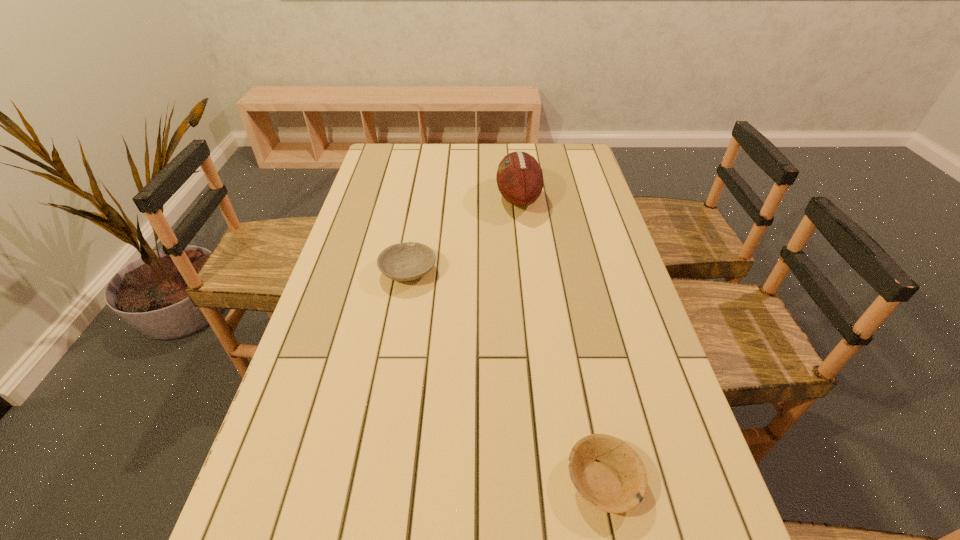
The width and height of the screenshot is (960, 540). I want to click on the tallest object, so click(x=519, y=177).

Where is `football (American)`? The image size is (960, 540). football (American) is located at coordinates (519, 177).

I want to click on the second nearest object, so click(x=407, y=261).

Where is `the farther bowl`? The height and width of the screenshot is (540, 960). the farther bowl is located at coordinates (407, 261).

Image resolution: width=960 pixels, height=540 pixels. I want to click on the nearest object, so click(608, 474).

Identify the location of the nearer bowl. (608, 474).

At what (x,y) coordinates should I click in order to perform the action: click on free space located 0.140m on the front of the farthest object. Please return your answer as a coordinate pair (x, y). The width and height of the screenshot is (960, 540). Looking at the image, I should click on (524, 251).

The width and height of the screenshot is (960, 540). I want to click on free region located on the front of the leftmost object, so click(x=399, y=324).

Image resolution: width=960 pixels, height=540 pixels. What are the coordinates of `blank space located on the left of the nearest object` in the screenshot? It's located at (455, 480).

Identify the location of object situated at the left edge. click(407, 261).